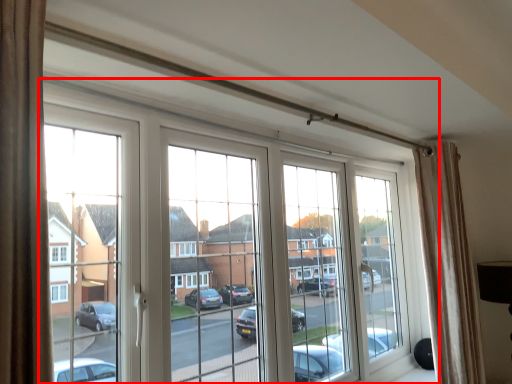
Question: From the image's perspective, considering the relative positions of window (annotated by the red box) and curtain in the image provided, where is window (annotated by the red box) located with respect to the staircase?

Choices:
 (A) below
 (B) above

Answer: (B)